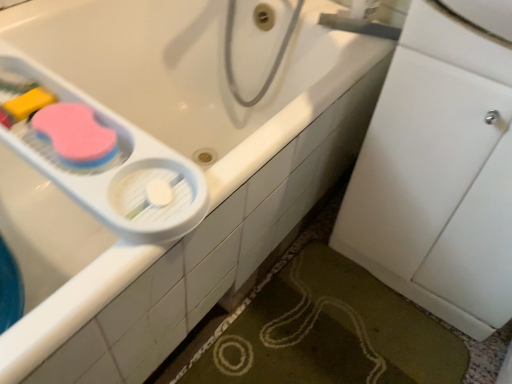
Question: From a real-world perspective, relative to white plastic container at upper left, is white plastic faucet at upper right vertically above or below?

Choices:
 (A) below
 (B) above

Answer: (B)

Question: Which is correct: white plastic faucet at upper right is inside white plastic container at upper left, or outside of it?

Choices:
 (A) inside
 (B) outside

Answer: (B)

Question: Which object is positioned farthest from the white plastic faucet at upper right?

Choices:
 (A) white plastic container at upper left
 (B) green textured bath mat at lower right

Answer: (B)

Question: Which object is positioned closest to the green textured bath mat at lower right?

Choices:
 (A) white plastic faucet at upper right
 (B) white plastic container at upper left

Answer: (B)